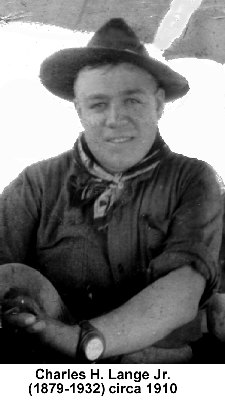
You are a GUI agent. You are given a task and a screenshot of the screen. Output one action in this format:
    pyautogui.click(x=<x>, y=<y>)
    Task: Click on the 1 black and white photo
    
    Given the screenshot: What is the action you would take?
    pyautogui.click(x=26, y=146)